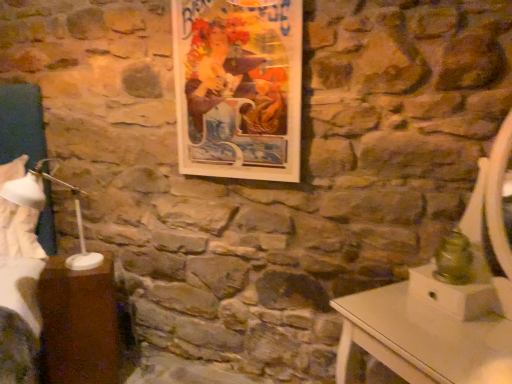
Question: Does white plastic bedside lamp at left have a lesser width compared to wooden picture frame at upper center?

Choices:
 (A) yes
 (B) no

Answer: (B)

Question: From the image's perspective, is white plastic bedside lamp at left over wooden picture frame at upper center?

Choices:
 (A) yes
 (B) no

Answer: (B)

Question: Considering the relative positions of white plastic bedside lamp at left and wooden picture frame at upper center in the image provided, is white plastic bedside lamp at left behind wooden picture frame at upper center?

Choices:
 (A) yes
 (B) no

Answer: (B)

Question: From the image's perspective, would you say white plastic bedside lamp at left is shown under wooden picture frame at upper center?

Choices:
 (A) yes
 (B) no

Answer: (A)

Question: Is white plastic bedside lamp at left outside wooden picture frame at upper center?

Choices:
 (A) no
 (B) yes

Answer: (B)

Question: Does white plastic bedside lamp at left have a lesser height compared to wooden picture frame at upper center?

Choices:
 (A) no
 (B) yes

Answer: (B)

Question: Is wooden picture frame at upper center next to white fabric at left and touching it?

Choices:
 (A) yes
 (B) no

Answer: (B)

Question: Does wooden picture frame at upper center appear on the right side of white fabric at left?

Choices:
 (A) no
 (B) yes

Answer: (B)

Question: Can white fabric at left be found inside wooden picture frame at upper center?

Choices:
 (A) no
 (B) yes

Answer: (A)

Question: Can you confirm if wooden picture frame at upper center is shorter than white fabric at left?

Choices:
 (A) yes
 (B) no

Answer: (A)

Question: Could you tell me if wooden picture frame at upper center is facing white fabric at left?

Choices:
 (A) yes
 (B) no

Answer: (B)

Question: Does wooden picture frame at upper center have a greater height compared to white fabric at left?

Choices:
 (A) no
 (B) yes

Answer: (A)

Question: Can you confirm if brown wood table at lower left is positioned to the left of wooden picture frame at upper center?

Choices:
 (A) no
 (B) yes

Answer: (B)